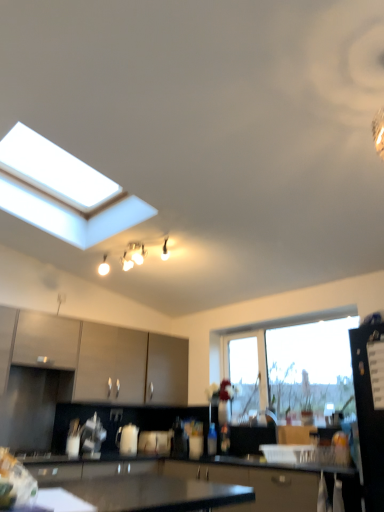
Question: Choose the correct answer: Is matte white light fixture at upper center inside black glossy refrigerator at right, placed as the 2th appliance when sorted from back to front, or outside it?

Choices:
 (A) outside
 (B) inside

Answer: (A)

Question: Looking at the image, does matte white light fixture at upper center seem bigger or smaller compared to black glossy refrigerator at right, which ranks as the 2th appliance in bottom-to-top order?

Choices:
 (A) big
 (B) small

Answer: (B)

Question: Estimate the real-world distances between objects in this image. Which object is farther from the transparent glass window at center?

Choices:
 (A) matte gray cabinets at center, the second cabinetry viewed from the left
 (B) matte brown cabinet at left, arranged as the 2th cabinetry when viewed from the right
 (C) matte white light fixture at upper center
 (D) white glossy kettle at center, which appears as the 1th appliance when ordered from the bottom
 (E) black glossy refrigerator at right, the 1th appliance from the front

Answer: (B)

Question: Estimate the real-world distances between objects in this image. Which object is closer to the black glossy refrigerator at right, placed as the 2th appliance when sorted from back to front?

Choices:
 (A) matte gray cabinets at center, which is the first cabinetry in right-to-left order
 (B) matte white light fixture at upper center
 (C) matte brown cabinet at left, acting as the first cabinetry starting from the left
 (D) white glossy kettle at center, which is the second appliance from right to left
 (E) transparent glass window at center

Answer: (E)